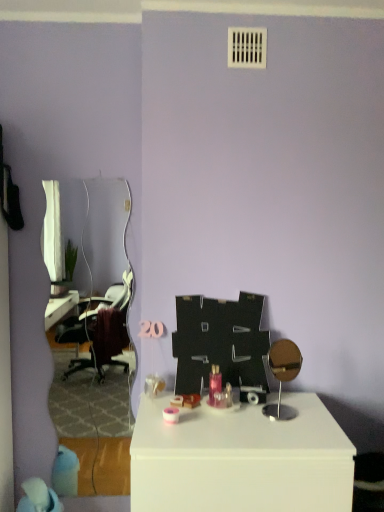
The width and height of the screenshot is (384, 512). In order to click on empty space that is ontop of white glossy table at center (from a real-world perspective) in this screenshot , I will do pyautogui.click(x=240, y=417).